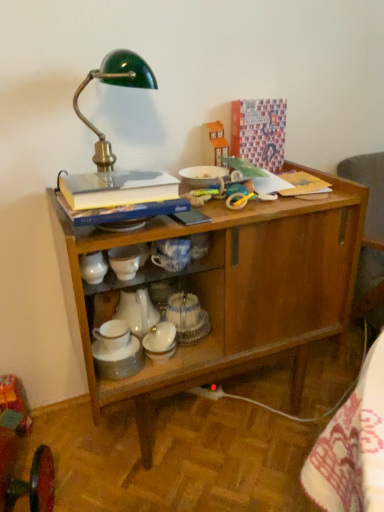
Question: Considering the positions of wooden cabinet at center and green enameled metal desk lamp at upper left in the image, is wooden cabinet at center bigger or smaller than green enameled metal desk lamp at upper left?

Choices:
 (A) big
 (B) small

Answer: (A)

Question: From a real-world perspective, is wooden cabinet at center above or below green enameled metal desk lamp at upper left?

Choices:
 (A) above
 (B) below

Answer: (B)

Question: Which is nearer to the wooden cabinet at center?

Choices:
 (A) hardcover book at upper left
 (B) green enameled metal desk lamp at upper left
 (C) white porcelain teapot at center

Answer: (C)

Question: Which of these objects is positioned closest to the hardcover book at upper left?

Choices:
 (A) green enameled metal desk lamp at upper left
 (B) wooden cabinet at center
 (C) white porcelain teapot at center

Answer: (A)